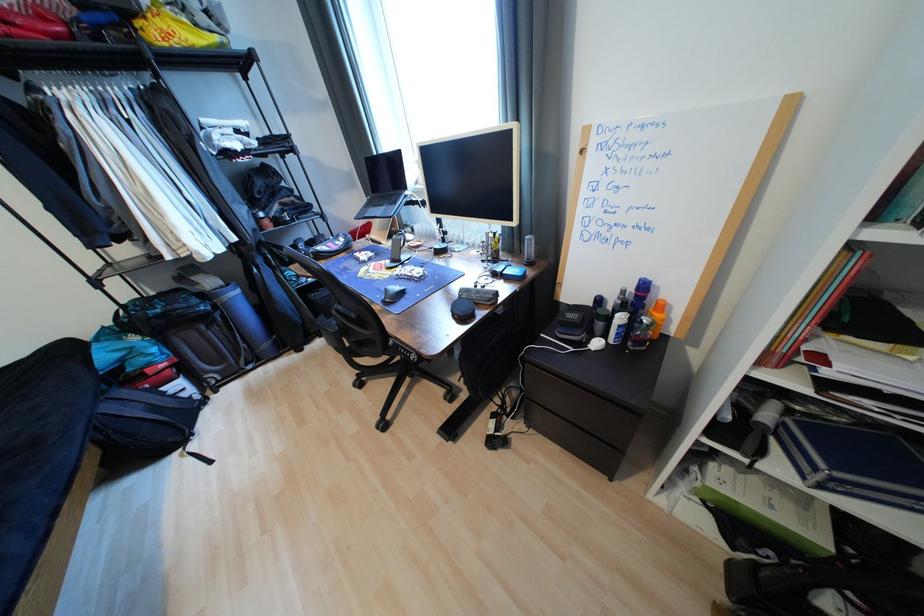
Describe the element at coordinates (639, 294) in the screenshot. I see `a blue cap spray can` at that location.